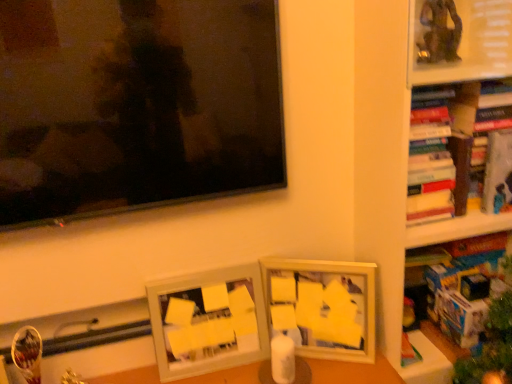
Question: Does hardcover book at upper right, the third book ordered from the bottom, have a greater height compared to blue cardboard book at right, acting as the 1th book starting from the bottom?

Choices:
 (A) no
 (B) yes

Answer: (A)

Question: Does hardcover book at upper right, the third book ordered from the bottom, touch blue cardboard book at right, arranged as the 3th book when viewed from the top?

Choices:
 (A) yes
 (B) no

Answer: (B)

Question: From the image's perspective, is hardcover book at upper right, the third book ordered from the bottom, above blue cardboard book at right, arranged as the 3th book when viewed from the top?

Choices:
 (A) no
 (B) yes

Answer: (B)

Question: Would you say blue cardboard book at right, acting as the 1th book starting from the bottom, is part of hardcover book at upper right, the third book ordered from the bottom,'s contents?

Choices:
 (A) yes
 (B) no

Answer: (B)

Question: Is hardcover book at upper right, the third book ordered from the bottom, facing towards blue cardboard book at right, arranged as the 3th book when viewed from the top?

Choices:
 (A) no
 (B) yes

Answer: (A)

Question: Is hardcover book at upper right, the third book ordered from the bottom, shorter than blue cardboard book at right, arranged as the 3th book when viewed from the top?

Choices:
 (A) no
 (B) yes

Answer: (B)

Question: Is the position of wooden bookshelf at right less distant than that of matte white picture frame at center, the 2th picture frame when ordered from left to right?

Choices:
 (A) yes
 (B) no

Answer: (A)

Question: Considering the relative sizes of wooden bookshelf at right and matte white picture frame at center, arranged as the 1th picture frame when viewed from the right, in the image provided, is wooden bookshelf at right thinner than matte white picture frame at center, arranged as the 1th picture frame when viewed from the right,?

Choices:
 (A) no
 (B) yes

Answer: (A)

Question: Does wooden bookshelf at right lie behind matte white picture frame at center, the 2th picture frame when ordered from left to right?

Choices:
 (A) no
 (B) yes

Answer: (A)

Question: Is wooden bookshelf at right smaller than matte white picture frame at center, arranged as the 1th picture frame when viewed from the right?

Choices:
 (A) yes
 (B) no

Answer: (B)

Question: Is the surface of wooden bookshelf at right in direct contact with matte white picture frame at center, arranged as the 1th picture frame when viewed from the right?

Choices:
 (A) no
 (B) yes

Answer: (A)

Question: Is wooden bookshelf at right not close to matte white picture frame at center, arranged as the 1th picture frame when viewed from the right?

Choices:
 (A) yes
 (B) no

Answer: (B)

Question: From a real-world perspective, is white matte picture frame at center, which is the 2th picture frame from right to left, positioned over matte black television at upper left based on gravity?

Choices:
 (A) no
 (B) yes

Answer: (A)